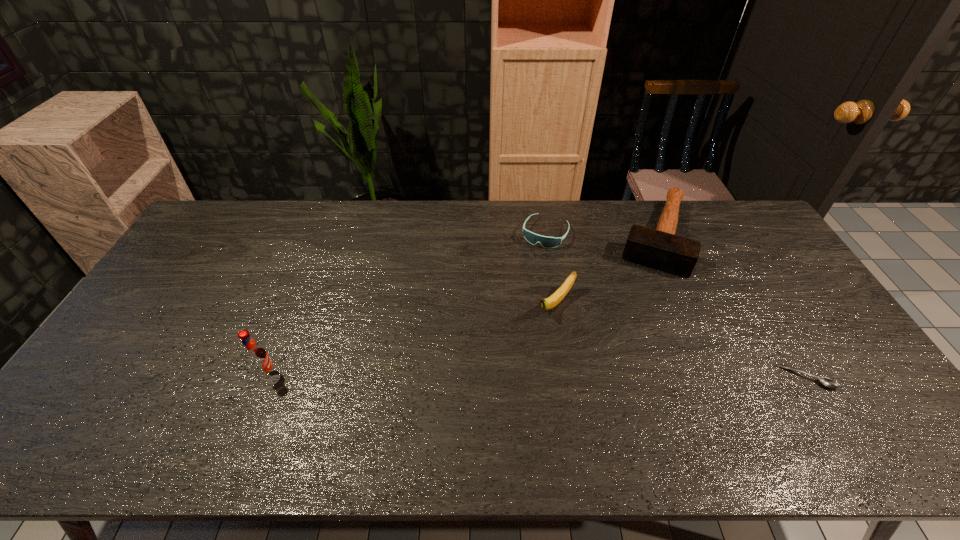
Locate an element on the screen. This screenshot has width=960, height=540. vacant space on the desktop that is between the leftmost object and the rightmost object and is positioned on the front-facing side of the fourth tallest object is located at coordinates 472,376.

Find the location of a particular element. vacant space on the desktop that is between the tallest object and the soupspoon and is positioned at the stem of the third nearest object is located at coordinates (480, 376).

The image size is (960, 540). Identify the location of vacant space on the desktop that is between the tallest object and the rightmost object and is positioned on the striking face of the mallet. (614, 376).